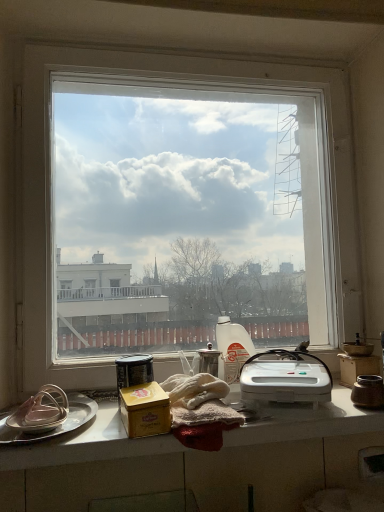
This screenshot has width=384, height=512. What are the coordinates of `free space to the left of gold matte tin at center, the 3th appliance in the left-to-right sequence` in the screenshot? It's located at (101, 428).